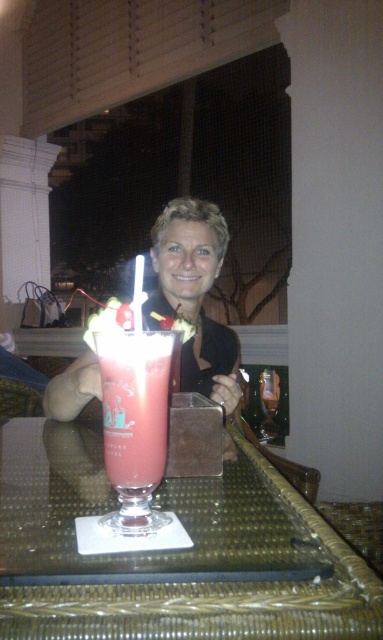
Question: Which of these objects is positioned farthest from the matte black dress at center?

Choices:
 (A) clear glass table at center
 (B) translucent pink smoothie at center

Answer: (B)

Question: Considering the relative positions of matte pink glass at center and matte black dress at center in the image provided, where is matte pink glass at center located with respect to matte black dress at center?

Choices:
 (A) right
 (B) left

Answer: (B)

Question: Is the position of clear glass table at center less distant than that of matte pink glass at center?

Choices:
 (A) no
 (B) yes

Answer: (B)

Question: Where is clear glass table at center located in relation to matte pink glass at center in the image?

Choices:
 (A) below
 (B) above

Answer: (A)

Question: Among these objects, which one is nearest to the camera?

Choices:
 (A) matte pink glass at center
 (B) translucent pink smoothie at center

Answer: (B)

Question: Which point is farther to the camera?

Choices:
 (A) translucent pink smoothie at center
 (B) matte black dress at center

Answer: (B)